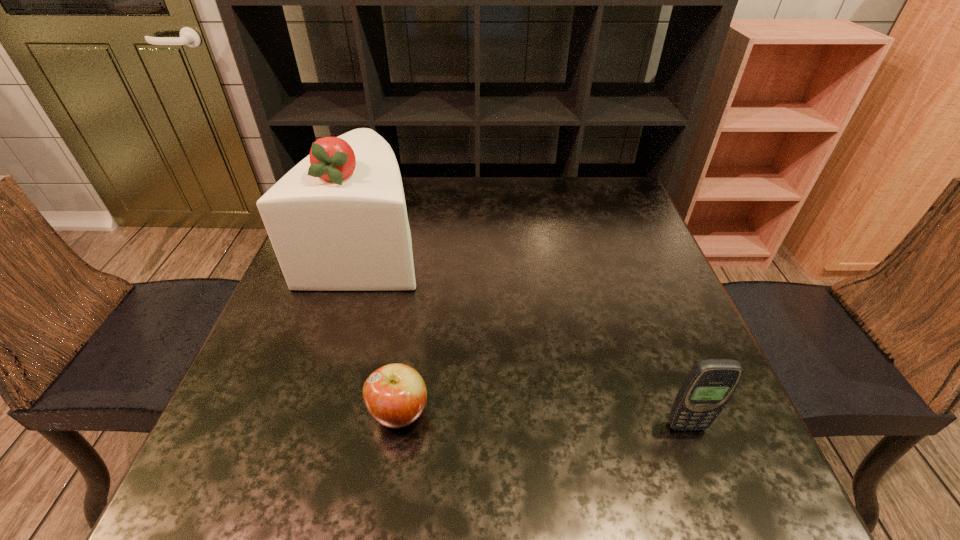
What are the coordinates of `free area in between the cellular telephone and the cake` in the screenshot? It's located at (526, 335).

Locate an element on the screen. This screenshot has height=540, width=960. free space between the cellular telephone and the shortest object is located at coordinates (542, 419).

Locate an element on the screen. This screenshot has width=960, height=540. vacant space that's between the tallest object and the shortest object is located at coordinates (383, 329).

Image resolution: width=960 pixels, height=540 pixels. Identify the location of free spot between the tallest object and the second shortest object. [526, 335].

You are a GUI agent. You are given a task and a screenshot of the screen. Output one action in this format:
    pyautogui.click(x=<x>, y=<y>)
    Task: Click on the unoccupied position between the apple and the second tallest object
    The width and height of the screenshot is (960, 540).
    Given the screenshot: What is the action you would take?
    pyautogui.click(x=542, y=419)

Where is `empty space between the rightmost object and the tallest object`? Image resolution: width=960 pixels, height=540 pixels. empty space between the rightmost object and the tallest object is located at coordinates (526, 335).

Locate an element on the screen. vacant point located between the apple and the farthest object is located at coordinates (383, 329).

Locate which object is the second closest to the apple. Please provide its 2D coordinates. Your answer should be formatted as a tuple, i.e. [(x, y)], where the tuple contains the x and y coordinates of a point satisfying the conditions above.

[(710, 384)]

Identify which object is located as the nearest to the farthest object. Please provide its 2D coordinates. Your answer should be formatted as a tuple, i.e. [(x, y)], where the tuple contains the x and y coordinates of a point satisfying the conditions above.

[(395, 395)]

This screenshot has height=540, width=960. In order to click on vacant space that satisfies the following two spatial constraints: 1. on the front side of the cake; 2. on the left side of the shortest object in this screenshot , I will do `click(315, 413)`.